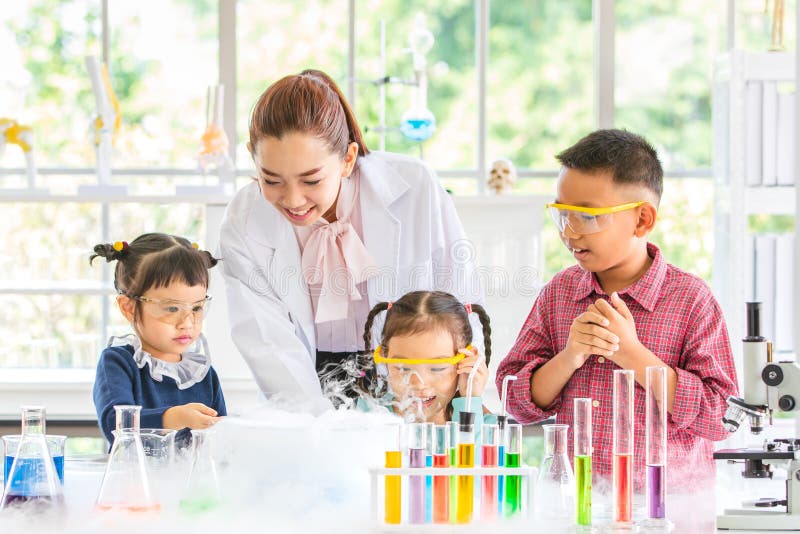
The height and width of the screenshot is (534, 800). I want to click on frame, so click(105, 194).